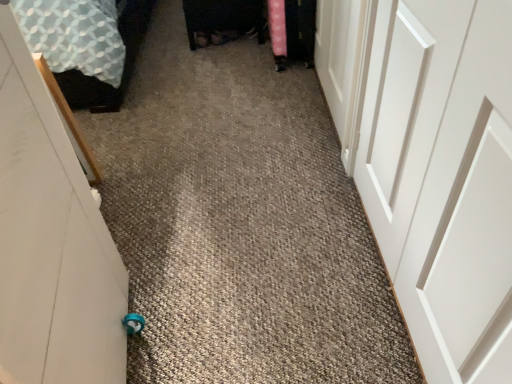
The width and height of the screenshot is (512, 384). In order to click on vacant region to the left of white smooth door at right, which is counted as the first door, starting from the right in this screenshot , I will do `click(260, 275)`.